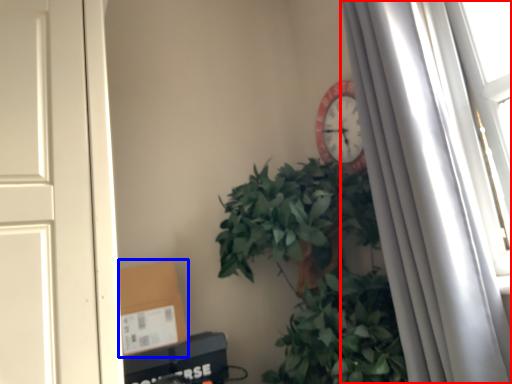
Question: Which of the following is the closest to the observer, curtain (highlighted by a red box) or cardboard box (highlighted by a blue box)?

Choices:
 (A) curtain
 (B) cardboard box

Answer: (A)